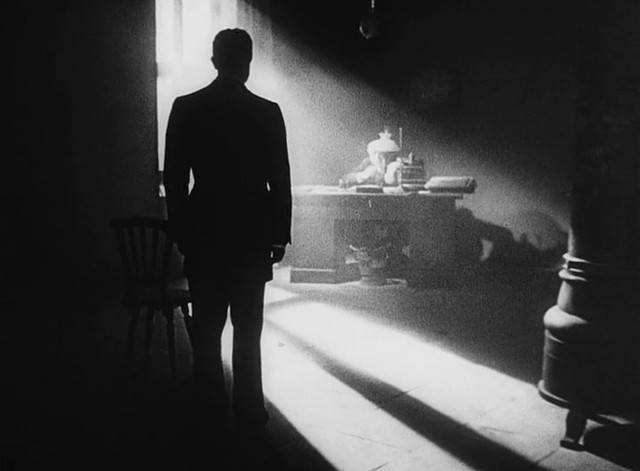
Identify the location of lamp. (381, 150).